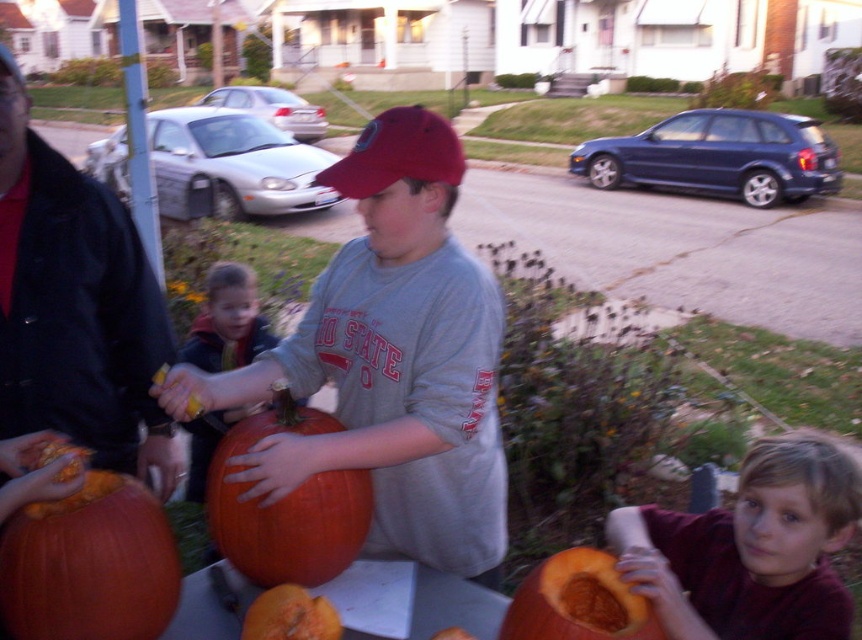
Between brushed metal pumpkin at lower left and orange matte pumpkin at lower center, which one is positioned higher?

Positioned higher is brushed metal pumpkin at lower left.

Is point (11, 403) behind point (308, 627)?

Yes, point (11, 403) is behind point (308, 627).

Which is in front, point (85, 216) or point (250, 632)?

Point (250, 632)

Find the location of a particular element. The image size is (862, 640). brushed metal pumpkin at lower left is located at coordinates (75, 305).

Can you confirm if orange matte pumpkin at center is taller than orange matte pumpkin at lower right?

Indeed, orange matte pumpkin at center has a greater height compared to orange matte pumpkin at lower right.

Between point (350, 488) and point (507, 627), which one is positioned behind?

Positioned behind is point (350, 488).

The height and width of the screenshot is (640, 862). I want to click on orange matte pumpkin at center, so click(x=286, y=506).

Between matte gray shirt at center and brushed metal pumpkin at lower left, which one has more height?

brushed metal pumpkin at lower left

Is matte gray shirt at center to the left of brushed metal pumpkin at lower left from the viewer's perspective?

Incorrect, matte gray shirt at center is not on the left side of brushed metal pumpkin at lower left.

You are a GUI agent. You are given a task and a screenshot of the screen. Output one action in this format:
    pyautogui.click(x=<x>, y=<y>)
    Task: Click on the matte gray shirt at center
    The width and height of the screenshot is (862, 640).
    Given the screenshot: What is the action you would take?
    pyautogui.click(x=390, y=360)